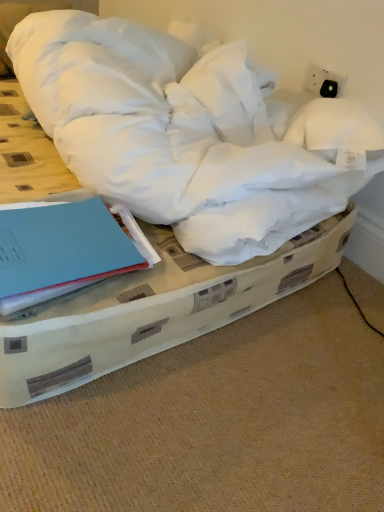
Question: From a real-world perspective, is blue matte book at lower left located beneath white soft bed at center?

Choices:
 (A) no
 (B) yes

Answer: (A)

Question: Is the depth of blue matte book at lower left greater than that of white soft bed at center?

Choices:
 (A) yes
 (B) no

Answer: (A)

Question: Is blue matte book at lower left positioned with its back to white soft bed at center?

Choices:
 (A) yes
 (B) no

Answer: (B)

Question: Is blue matte book at lower left positioned far away from white soft bed at center?

Choices:
 (A) yes
 (B) no

Answer: (B)

Question: Does blue matte book at lower left appear on the right side of white soft bed at center?

Choices:
 (A) no
 (B) yes

Answer: (A)

Question: Does blue matte book at lower left appear on the left side of white soft bed at center?

Choices:
 (A) yes
 (B) no

Answer: (A)

Question: From a real-world perspective, is white soft bed at center beneath blue matte book at lower left?

Choices:
 (A) yes
 (B) no

Answer: (A)

Question: Is white soft bed at center wider than blue matte book at lower left?

Choices:
 (A) yes
 (B) no

Answer: (A)

Question: From the image's perspective, does white soft bed at center appear lower than blue matte book at lower left?

Choices:
 (A) no
 (B) yes

Answer: (A)

Question: Is white soft bed at center at the right side of blue matte book at lower left?

Choices:
 (A) yes
 (B) no

Answer: (A)

Question: Are white soft bed at center and blue matte book at lower left beside each other?

Choices:
 (A) yes
 (B) no

Answer: (B)

Question: Is white soft bed at center further to the viewer compared to blue matte book at lower left?

Choices:
 (A) yes
 (B) no

Answer: (B)

Question: Considering the positions of white soft bed at center and blue matte book at lower left in the image, is white soft bed at center bigger or smaller than blue matte book at lower left?

Choices:
 (A) big
 (B) small

Answer: (A)